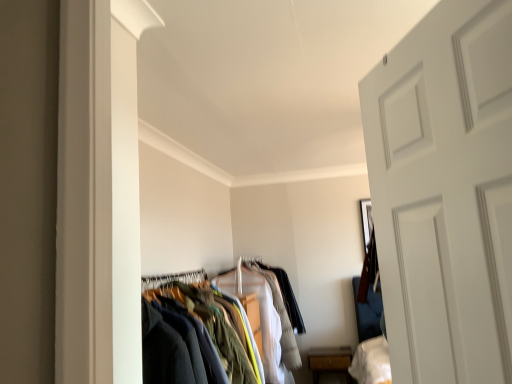
The height and width of the screenshot is (384, 512). I want to click on textured fabric clothes at center, so click(x=269, y=299).

What do you see at coordinates (269, 299) in the screenshot? The height and width of the screenshot is (384, 512). I see `textured fabric clothes at center` at bounding box center [269, 299].

Identify the location of textured fabric clothes at center. (269, 299).